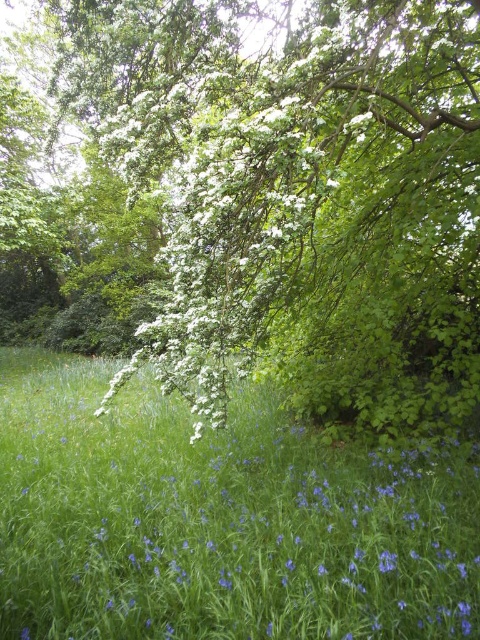
You are a bird looking for a place to land. You see the green leafy tree at upper center and the white matte flower at center. Which one is closer to you?

The white matte flower at center is closer to you than the green leafy tree at upper center since they are 6.23 meters apart.

You are an artist setting up an easel to paint the green leafy tree at upper center and the white matte flower at center. Which object should you focus on first if you want to paint the wider one first?

The green leafy tree at upper center is wider than the white matte flower at center, so you should focus on the green leafy tree at upper center first.

You are an artist sketching this scene from the perspective of standing in the field of grass. Which object would appear closer to you when focusing on the green leafy tree at upper center and the white matte flower at center?

The green leafy tree at upper center appears closer to you because it is positioned further to the viewer than the white matte flower at center, making it seem nearer in your sketch.